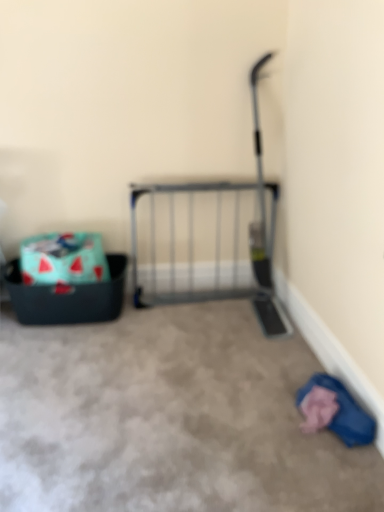
Question: Is metal gate at center facing towards carpet at center?

Choices:
 (A) no
 (B) yes

Answer: (B)

Question: Can you confirm if metal gate at center is taller than carpet at center?

Choices:
 (A) yes
 (B) no

Answer: (A)

Question: Is metal gate at center facing away from carpet at center?

Choices:
 (A) yes
 (B) no

Answer: (B)

Question: Can you confirm if metal gate at center is bigger than carpet at center?

Choices:
 (A) yes
 (B) no

Answer: (B)

Question: From a real-world perspective, is metal gate at center positioned over carpet at center based on gravity?

Choices:
 (A) no
 (B) yes

Answer: (B)

Question: Is point (120, 289) positioned closer to the camera than point (218, 238)?

Choices:
 (A) closer
 (B) farther

Answer: (A)

Question: Looking at the image, does teal fabric storage box at left, which is the first storage box in bottom-to-top order, seem bigger or smaller compared to metal gate at center?

Choices:
 (A) small
 (B) big

Answer: (A)

Question: From their relative heights in the image, would you say teal fabric storage box at left, which is the first storage box in bottom-to-top order, is taller or shorter than metal gate at center?

Choices:
 (A) short
 (B) tall

Answer: (A)

Question: From the image's perspective, relative to metal gate at center, is teal fabric storage box at left, which is the 2th storage box in top-to-bottom order, above or below?

Choices:
 (A) above
 (B) below

Answer: (B)

Question: From the image's perspective, is metal gate at center above or below watermelon-patterned fabric storage box at left, acting as the 1th storage box starting from the top?

Choices:
 (A) above
 (B) below

Answer: (A)

Question: Is metal gate at center in front of or behind watermelon-patterned fabric storage box at left, the second storage box from the bottom, in the image?

Choices:
 (A) front
 (B) behind

Answer: (B)

Question: From a real-world perspective, is metal gate at center above or below watermelon-patterned fabric storage box at left, acting as the 1th storage box starting from the top?

Choices:
 (A) below
 (B) above

Answer: (B)

Question: In terms of height, does metal gate at center look taller or shorter compared to watermelon-patterned fabric storage box at left, acting as the 1th storage box starting from the top?

Choices:
 (A) tall
 (B) short

Answer: (A)

Question: Is metal gate at center inside or outside of carpet at center?

Choices:
 (A) outside
 (B) inside

Answer: (A)

Question: Is point pos(271,293) closer or farther from the camera than point pos(43,423)?

Choices:
 (A) farther
 (B) closer

Answer: (A)